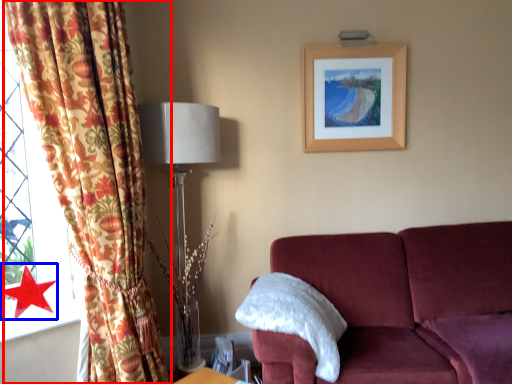
Question: Which of the following is the farthest to the observer, curtain (highlighted by a red box) or star (highlighted by a blue box)?

Choices:
 (A) curtain
 (B) star

Answer: (B)